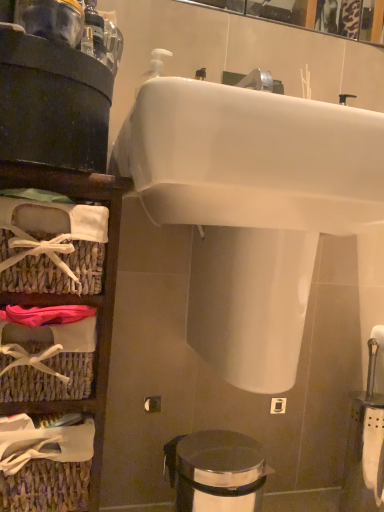
Identify the location of blank space above polished stainless steel trash can at lower center (from a real-world perspective). 224,448.